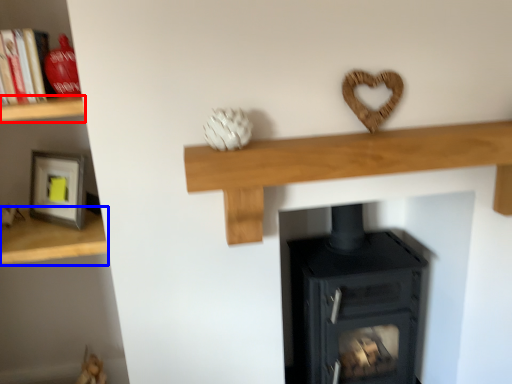
Question: Which point is closer to the camera, shelf (highlighted by a red box) or shelf (highlighted by a blue box)?

Choices:
 (A) shelf
 (B) shelf

Answer: (A)